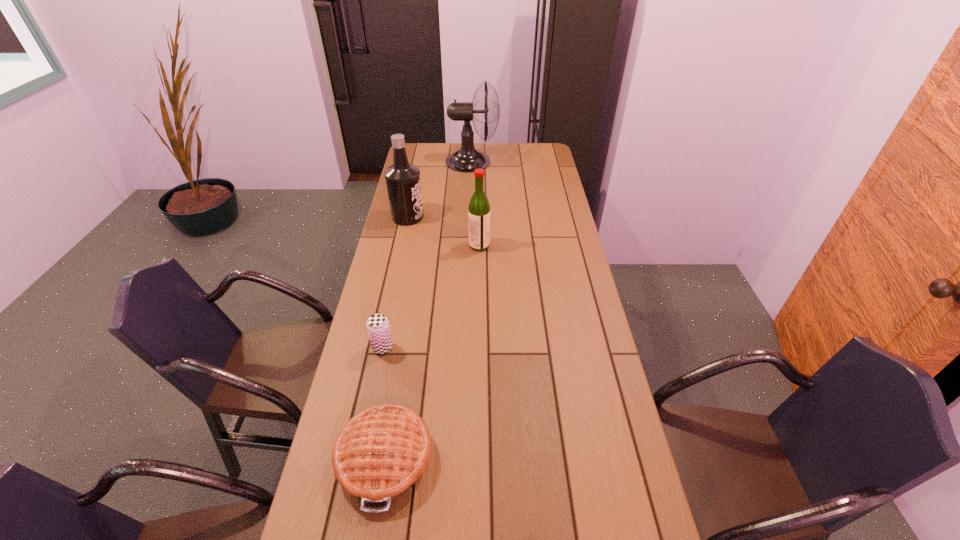
Image resolution: width=960 pixels, height=540 pixels. Identify the location of free space at the right edge of the desktop. (545, 173).

Find the location of `free space between the left liquor and the fan`. free space between the left liquor and the fan is located at coordinates coord(440,189).

At what (x,y) coordinates should I click in order to perform the action: click on vacant space in between the fan and the shortest object. Please return your answer as a coordinate pair (x, y). The width and height of the screenshot is (960, 540). Looking at the image, I should click on (428, 310).

Locate an element on the screen. free space between the nearest object and the beer can is located at coordinates (384, 402).

Identify the location of vacant area that lies between the shortest object and the farthest object. This screenshot has height=540, width=960. (428, 310).

This screenshot has height=540, width=960. What are the coordinates of `free point between the right liquor and the second nearest object` in the screenshot? It's located at (431, 296).

Identify which object is the third nearest to the fan. Please provide its 2D coordinates. Your answer should be formatted as a tuple, i.e. [(x, y)], where the tuple contains the x and y coordinates of a point satisfying the conditions above.

[(377, 325)]

Identify which object is the second closest to the shortest object. Please provide its 2D coordinates. Your answer should be formatted as a tuple, i.e. [(x, y)], where the tuple contains the x and y coordinates of a point satisfying the conditions above.

[(479, 208)]

At what (x,y) coordinates should I click in order to perform the action: click on free space that satisfies the following two spatial constraints: 1. on the label of the right liquor; 2. on the front side of the fourth tallest object. Please return your answer as a coordinate pair (x, y). Looking at the image, I should click on (479, 347).

Image resolution: width=960 pixels, height=540 pixels. I want to click on free spot that satisfies the following two spatial constraints: 1. on the front label of the fourth nearest object; 2. on the left side of the beer can, so click(x=380, y=347).